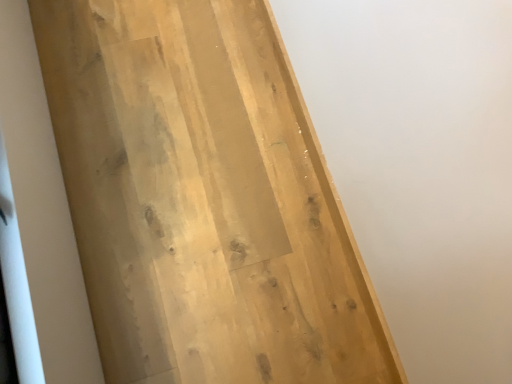
Identify the location of free space above natural wood door at center (from a real-world perspective). Image resolution: width=512 pixels, height=384 pixels. (176, 209).